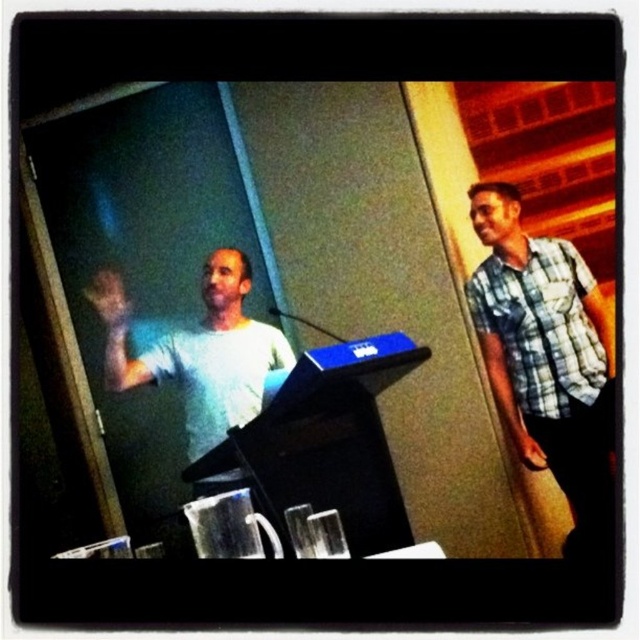
Question: In this image, where is checkered fabric shirt at right located relative to white matte t-shirt at center?

Choices:
 (A) right
 (B) left

Answer: (A)

Question: Where is checkered fabric shirt at right located in relation to white matte t-shirt at center in the image?

Choices:
 (A) left
 (B) right

Answer: (B)

Question: Can you confirm if checkered fabric shirt at right is smaller than white matte t-shirt at center?

Choices:
 (A) no
 (B) yes

Answer: (A)

Question: Which object is closer to the camera taking this photo?

Choices:
 (A) white matte t-shirt at center
 (B) checkered fabric shirt at right

Answer: (A)

Question: Which point is farther to the camera?

Choices:
 (A) white matte t-shirt at center
 (B) checkered fabric shirt at right

Answer: (B)